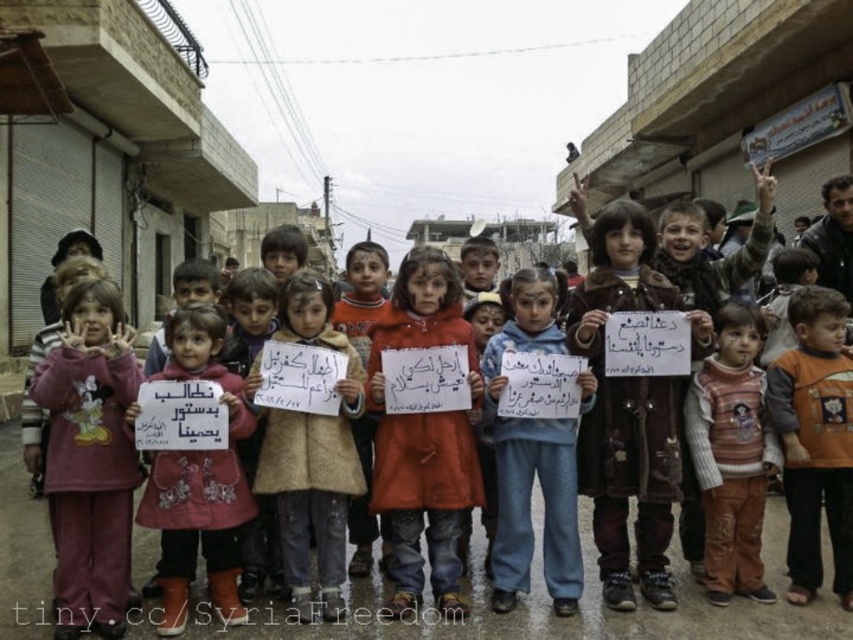
Who is positioned more to the left, orange fabric shirt at center or striped sweater at center?

striped sweater at center

Which of these two, orange fabric shirt at center or striped sweater at center, stands taller?

With more height is orange fabric shirt at center.

Identify the location of orange fabric shirt at center. The height and width of the screenshot is (640, 853). (815, 440).

Between maroon fleece sweatshirt at left and matte pink coat at center, which one appears on the right side from the viewer's perspective?

From the viewer's perspective, matte pink coat at center appears more on the right side.

Is maroon fleece sweatshirt at left to the right of matte pink coat at center from the viewer's perspective?

No, maroon fleece sweatshirt at left is not to the right of matte pink coat at center.

Which is behind, point (55, 570) or point (181, 380)?

Point (181, 380)

Where is `maroon fleece sweatshirt at left`? The height and width of the screenshot is (640, 853). maroon fleece sweatshirt at left is located at coordinates (90, 460).

Is red sweater at center to the right of orange fabric coat at center from the viewer's perspective?

Incorrect, red sweater at center is not on the right side of orange fabric coat at center.

Between red sweater at center and orange fabric coat at center, which one has less height?

red sweater at center

Where is `red sweater at center`? The width and height of the screenshot is (853, 640). red sweater at center is located at coordinates coord(579,605).